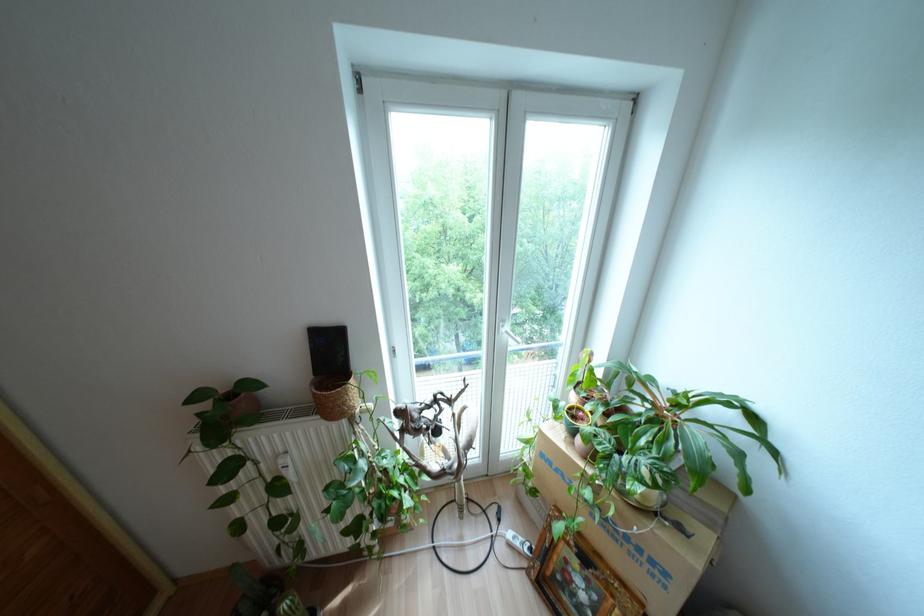
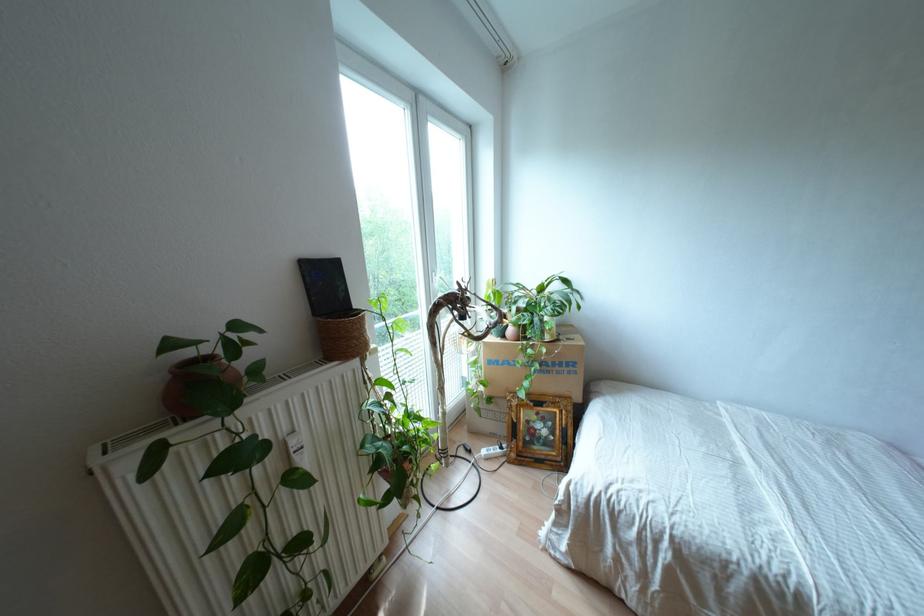
Where in the second image is the point corresponding to [579,439] from the first image?

(509, 330)